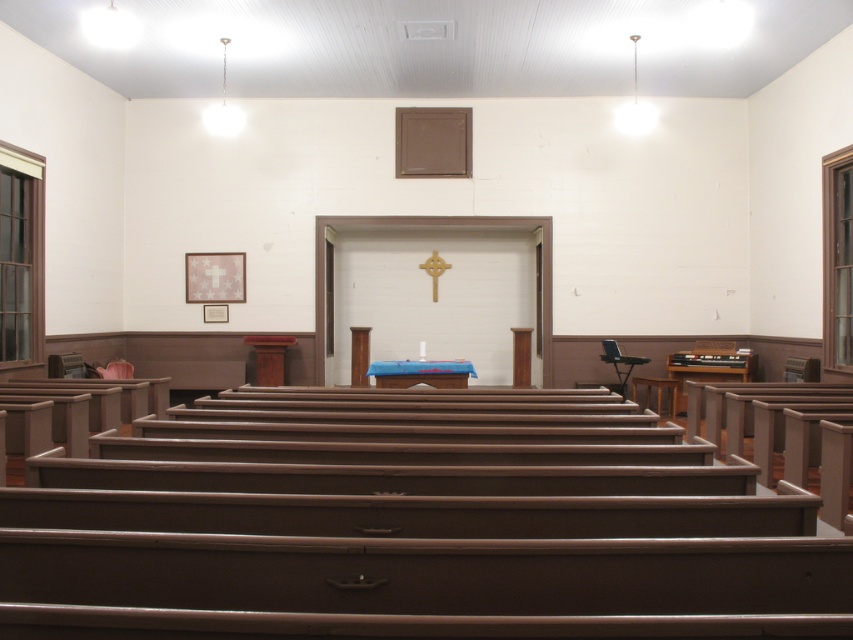
You are attending a ceremony in the church and need to sit down. There are a blue fabric altar at center and a brown wooden chair at center. Which one is lower to the ground so you can sit on it?

The brown wooden chair at center is lower to the ground than the blue fabric altar at center, so you can sit on it.

You are standing at the entrance of the church and want to sit down. There is a brown wooden chair at center. Can you walk straight from the entrance to reach it without obstacles?

Yes, because the brown wooden chair at center is located at point (656, 392), which is along the central axis of the church, so there are no pews blocking the path.